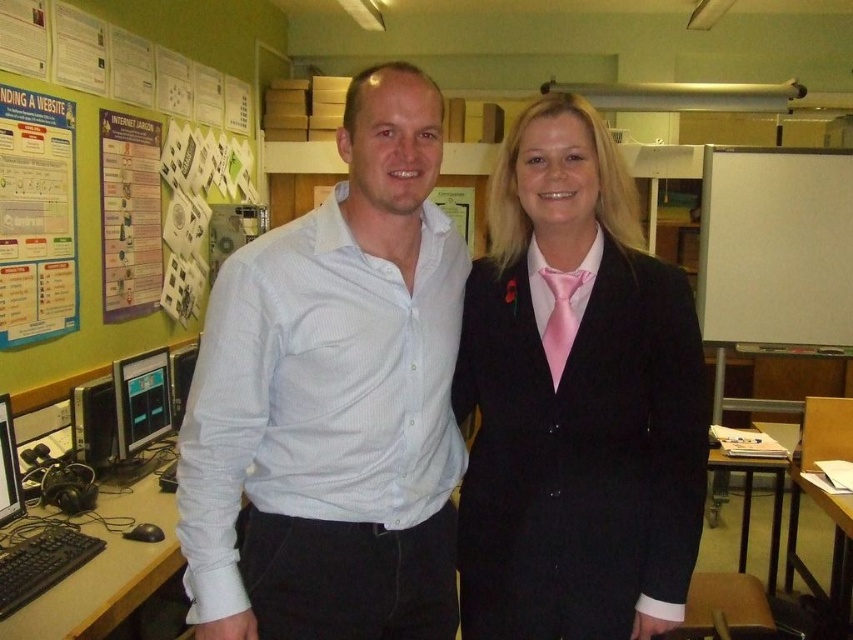
Question: Does white cotton shirt at center have a greater width compared to black glossy monitor at left?

Choices:
 (A) no
 (B) yes

Answer: (B)

Question: Which is farther from the white cotton shirt at center?

Choices:
 (A) matte black monitor at left
 (B) white matte board at right
 (C) black glossy monitor at left

Answer: (B)

Question: Which point is closer to the camera taking this photo?

Choices:
 (A) (367, 492)
 (B) (136, 196)
 (C) (134, 424)

Answer: (A)

Question: Which point is closer to the camera?

Choices:
 (A) (16, 483)
 (B) (146, 401)

Answer: (A)

Question: Is white paper at upper left positioned in front of black glossy monitor at left?

Choices:
 (A) no
 (B) yes

Answer: (B)

Question: Can you confirm if white matte board at right is smaller than matte black monitor at left?

Choices:
 (A) no
 (B) yes

Answer: (A)